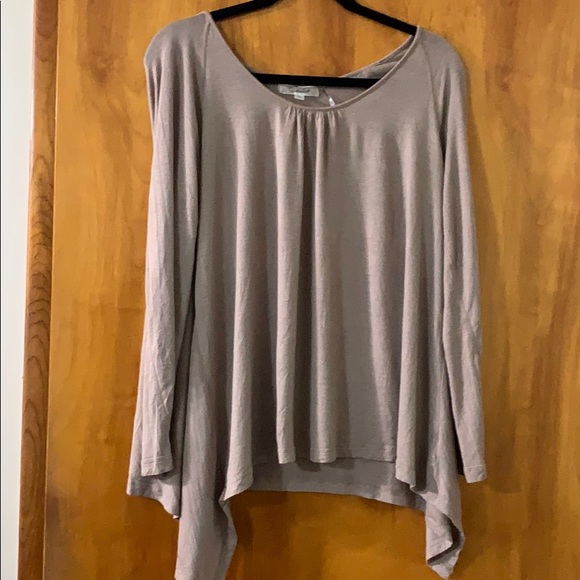
Identify the location of white wall. (17, 70).